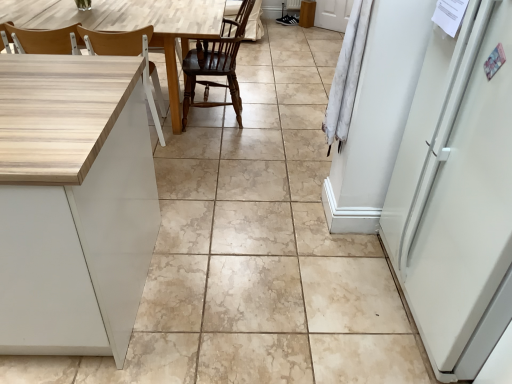
This screenshot has height=384, width=512. I want to click on vacant space in front of dark wood chair at center, the second chair from the left, so click(216, 148).